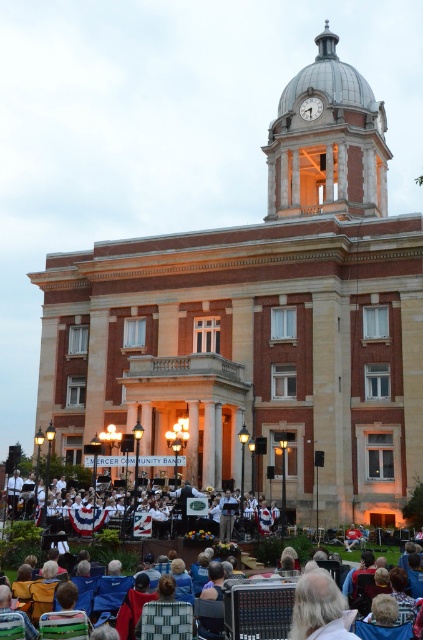
Based on the scene description, what are the coordinates of the metallic dome clock tower at upper center?

The metallic dome clock tower at upper center is located at coordinates 0.223 in the x axis and 0.775 in the y axis.

Consider the image. You are standing at the entrance of the historic building and see the white uniformed band at center. If you want to walk directly towards the band, which direction should you move relative to the building?

Since the white uniformed band at center is located at coordinates approximately 0.817 on the x axis and 0.608 on the y axis, you should move towards the center of the building to reach them.

You are standing at the base of the metallic dome clock tower at upper center and want to take a photo with your camera. The recommended distance for capturing the entire tower in one frame is 70 meters. Will you be able to step back far enough to achieve this?

The metallic dome clock tower at upper center and camera are 72.67 meters apart, which is beyond the recommended 70 meters distance. Therefore, you can step back far enough to capture the entire tower in one frame.